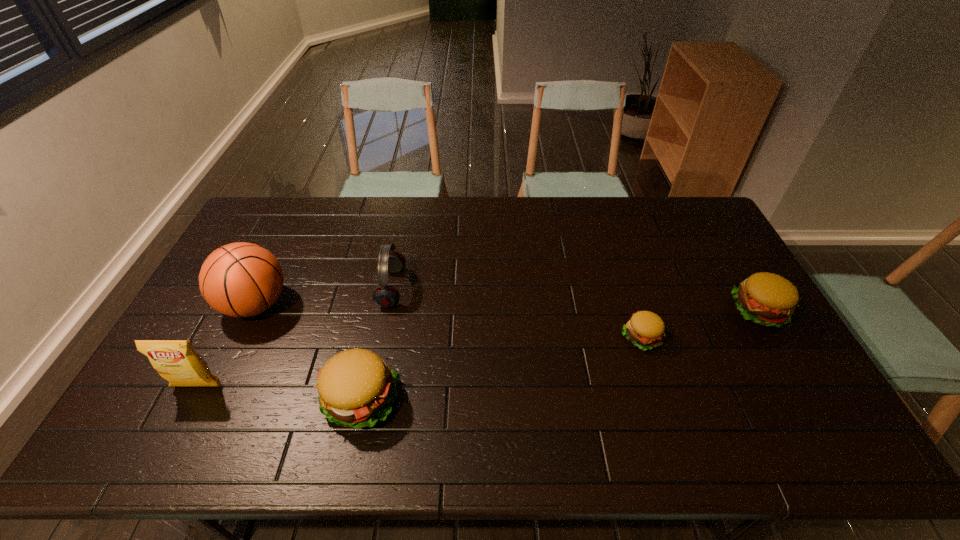
In the image, there is a desktop. Where is `blank space at the near edge`? This screenshot has height=540, width=960. blank space at the near edge is located at coordinates (489, 394).

This screenshot has width=960, height=540. I want to click on vacant region at the left edge of the desktop, so click(x=188, y=330).

Find the location of a particular element. The image size is (960, 540). vacant area at the right edge of the desktop is located at coordinates (736, 335).

You are a GUI agent. You are given a task and a screenshot of the screen. Output one action in this format:
    pyautogui.click(x=<x>, y=<y>)
    Task: Click on the vacant area at the near left corner
    
    Given the screenshot: What is the action you would take?
    pyautogui.click(x=192, y=394)

You are a GUI agent. You are given a task and a screenshot of the screen. Output one action in this format:
    pyautogui.click(x=<x>, y=<y>)
    Task: Click on the vacant space at the far right corner of the desktop
    This screenshot has width=960, height=540.
    Given the screenshot: What is the action you would take?
    pyautogui.click(x=666, y=202)

Where is `empty location between the basketball and the crisp (potato chip)`? The height and width of the screenshot is (540, 960). empty location between the basketball and the crisp (potato chip) is located at coordinates (228, 346).

The height and width of the screenshot is (540, 960). I want to click on vacant space that's between the basketball and the earphone, so tap(324, 296).

The image size is (960, 540). What are the coordinates of `vacant area that lies between the earphone and the crisp (potato chip)` in the screenshot? It's located at click(295, 338).

In order to click on unoccupied position between the basketball and the second hamburger from left to right in this screenshot , I will do `click(448, 321)`.

Locate an element on the screen. The width and height of the screenshot is (960, 540). free space between the crisp (potato chip) and the basketball is located at coordinates (228, 346).